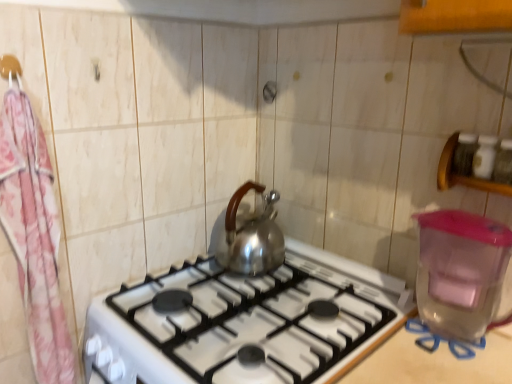
Question: From the image's perspective, is pink fabric hanger at upper left above pink floral fabric at left?

Choices:
 (A) no
 (B) yes

Answer: (B)

Question: Is pink fabric hanger at upper left positioned in front of pink floral fabric at left?

Choices:
 (A) yes
 (B) no

Answer: (B)

Question: Is pink fabric hanger at upper left bigger than pink floral fabric at left?

Choices:
 (A) no
 (B) yes

Answer: (A)

Question: Is pink fabric hanger at upper left smaller than pink floral fabric at left?

Choices:
 (A) no
 (B) yes

Answer: (B)

Question: Is pink fabric hanger at upper left outside of pink floral fabric at left?

Choices:
 (A) no
 (B) yes

Answer: (A)

Question: Would you consider pink fabric hanger at upper left to be distant from pink floral fabric at left?

Choices:
 (A) yes
 (B) no

Answer: (B)

Question: Is the surface of transparent plastic water heater at right in direct contact with pink floral fabric at left?

Choices:
 (A) no
 (B) yes

Answer: (A)

Question: From a real-world perspective, is transparent plastic water heater at right below pink floral fabric at left?

Choices:
 (A) no
 (B) yes

Answer: (B)

Question: From the image's perspective, would you say transparent plastic water heater at right is shown under pink floral fabric at left?

Choices:
 (A) yes
 (B) no

Answer: (A)

Question: Is transparent plastic water heater at right at the left side of pink floral fabric at left?

Choices:
 (A) yes
 (B) no

Answer: (B)

Question: From the image's perspective, is transparent plastic water heater at right over pink floral fabric at left?

Choices:
 (A) yes
 (B) no

Answer: (B)

Question: Is transparent plastic water heater at right shorter than pink floral fabric at left?

Choices:
 (A) yes
 (B) no

Answer: (A)

Question: Is satin silver gas stove at center shorter than pink floral fabric at left?

Choices:
 (A) yes
 (B) no

Answer: (A)